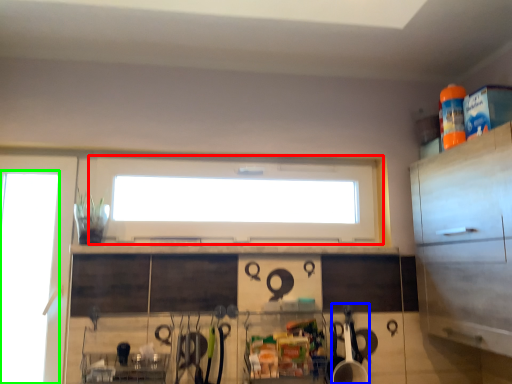
Question: Which object is the closest to the window (highlighted by a red box)? Choose among these: appliance (highlighted by a blue box) or glass door (highlighted by a green box).

Choices:
 (A) appliance
 (B) glass door

Answer: (B)